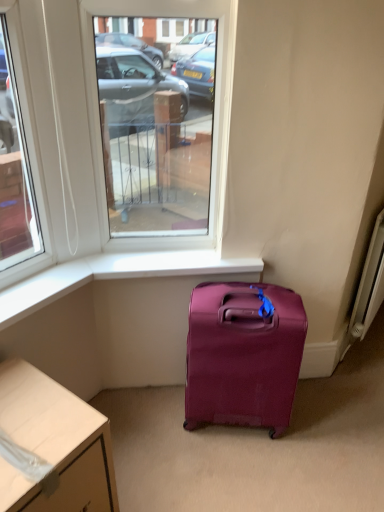
This screenshot has height=512, width=384. What do you see at coordinates (243, 355) in the screenshot?
I see `matte purple suitcase at lower center` at bounding box center [243, 355].

This screenshot has height=512, width=384. What do you see at coordinates (54, 445) in the screenshot?
I see `white glossy desk at lower left` at bounding box center [54, 445].

Describe the element at coordinates (170, 264) in the screenshot. I see `white smooth window sill at lower center` at that location.

Image resolution: width=384 pixels, height=512 pixels. Describe the element at coordinates (95, 123) in the screenshot. I see `clear glass window at center` at that location.

Describe the element at coordinates (369, 284) in the screenshot. I see `white metallic radiator at right` at that location.

This screenshot has width=384, height=512. I want to click on matte purple suitcase at lower center, so click(x=243, y=355).

From the image's perspective, is clear glass window at center beneath matte purple suitcase at lower center?

Incorrect, from the image's perspective, clear glass window at center is higher than matte purple suitcase at lower center.

From a real-world perspective, is clear glass window at center below matte purple suitcase at lower center?

Actually, clear glass window at center is physically above matte purple suitcase at lower center in the real world.

Between point (36, 45) and point (265, 297), which one is positioned in front?

The point (36, 45) is closer to the camera.

Looking at this image, based on their positions, is clear glass window at center located to the left or right of matte purple suitcase at lower center?

From the image, it's evident that clear glass window at center is to the left of matte purple suitcase at lower center.

Consider the image. Is matte purple suitcase at lower center looking in the opposite direction of clear glass window at center?

No, matte purple suitcase at lower center is not facing the opposite direction of clear glass window at center.

Can you confirm if matte purple suitcase at lower center is positioned to the right of clear glass window at center?

Correct, you'll find matte purple suitcase at lower center to the right of clear glass window at center.

Can you confirm if matte purple suitcase at lower center is bigger than clear glass window at center?

Indeed, matte purple suitcase at lower center has a larger size compared to clear glass window at center.

Is matte purple suitcase at lower center positioned far away from clear glass window at center?

Actually, matte purple suitcase at lower center and clear glass window at center are a little close together.

Is white smooth window sill at lower center touching clear glass window at center?

No, white smooth window sill at lower center is not next to clear glass window at center.

Is white smooth window sill at lower center to the right of clear glass window at center from the viewer's perspective?

Yes, white smooth window sill at lower center is to the right of clear glass window at center.

Which of these two, white smooth window sill at lower center or clear glass window at center, is thinner?

Thinner between the two is clear glass window at center.

From a real-world perspective, which is physically below, white smooth window sill at lower center or clear glass window at center?

From a 3D spatial view, white smooth window sill at lower center is below.

From the image's perspective, is white glossy desk at lower left below white smooth window sill at lower center?

Yes, from the image's perspective, white glossy desk at lower left is below white smooth window sill at lower center.

In the image, is white glossy desk at lower left positioned in front of or behind white smooth window sill at lower center?

white glossy desk at lower left is in front of white smooth window sill at lower center.

Are white glossy desk at lower left and white smooth window sill at lower center making contact?

They are not placed beside each other.

Locate an element on the screen. This screenshot has height=512, width=384. desk on the left of white smooth window sill at lower center is located at coordinates tap(54, 445).

Can you tell me how much white smooth window sill at lower center and matte purple suitcase at lower center differ in facing direction?

There is a 11-degree angle between the facing directions of white smooth window sill at lower center and matte purple suitcase at lower center.

Is white smooth window sill at lower center outside of matte purple suitcase at lower center?

Yes, white smooth window sill at lower center is located beyond the bounds of matte purple suitcase at lower center.

In the image, is white smooth window sill at lower center on the left side or the right side of matte purple suitcase at lower center?

white smooth window sill at lower center is positioned on matte purple suitcase at lower center's left side.

From the image's perspective, is white smooth window sill at lower center on matte purple suitcase at lower center?

Yes, from the image's perspective, white smooth window sill at lower center is above matte purple suitcase at lower center.

From a real-world perspective, which is physically above, white metallic radiator at right or white glossy desk at lower left?

white metallic radiator at right, from a real-world perspective.

Which point is more forward, (358, 288) or (88, 438)?

The point (88, 438) is closer.

Is white metallic radiator at right outside of white glossy desk at lower left?

white metallic radiator at right lies outside white glossy desk at lower left's area.

Consider the image. From a real-world perspective, which is physically below, clear glass window at center or white metallic radiator at right?

white metallic radiator at right.

In the scene shown: In terms of height, does clear glass window at center look taller or shorter compared to white metallic radiator at right?

clear glass window at center is taller than white metallic radiator at right.

Which object is further away from the camera, clear glass window at center or white metallic radiator at right?

white metallic radiator at right.

Considering the sizes of objects clear glass window at center and white metallic radiator at right in the image provided, who is smaller, clear glass window at center or white metallic radiator at right?

Smaller between the two is white metallic radiator at right.

Locate an element on the screen. window that appears in front of the matte purple suitcase at lower center is located at coordinates (95, 123).

Where is `luggage and bags lying below the clear glass window at center (from the image's perspective)`? The width and height of the screenshot is (384, 512). luggage and bags lying below the clear glass window at center (from the image's perspective) is located at coordinates (243, 355).

When comparing their distances from clear glass window at center, does white metallic radiator at right or white smooth window sill at lower center seem further?

white metallic radiator at right is positioned further to the anchor clear glass window at center.

Considering their positions, is matte purple suitcase at lower center positioned closer to white smooth window sill at lower center than clear glass window at center?

clear glass window at center is closer to white smooth window sill at lower center.

From the image, which object appears to be farther from white metallic radiator at right, white glossy desk at lower left or matte purple suitcase at lower center?

The object further to white metallic radiator at right is white glossy desk at lower left.

From the image, which object appears to be farther from matte purple suitcase at lower center, white glossy desk at lower left or clear glass window at center?

Among the two, white glossy desk at lower left is located further to matte purple suitcase at lower center.

When comparing their distances from white metallic radiator at right, does white glossy desk at lower left or white smooth window sill at lower center seem further?

white glossy desk at lower left is further to white metallic radiator at right.

Looking at the image, which one is located closer to white glossy desk at lower left, white metallic radiator at right or matte purple suitcase at lower center?

matte purple suitcase at lower center is positioned closer to the anchor white glossy desk at lower left.

When comparing their distances from white smooth window sill at lower center, does white glossy desk at lower left or matte purple suitcase at lower center seem further?

white glossy desk at lower left.

Looking at the image, which one is located closer to matte purple suitcase at lower center, white metallic radiator at right or white glossy desk at lower left?

white glossy desk at lower left is positioned closer to the anchor matte purple suitcase at lower center.

Identify the location of luggage and bags situated between clear glass window at center and white metallic radiator at right from left to right. This screenshot has width=384, height=512. (243, 355).

The image size is (384, 512). In order to click on window sill between clear glass window at center and white glossy desk at lower left in the vertical direction in this screenshot , I will do `click(170, 264)`.

This screenshot has height=512, width=384. Find the location of `luggage and bags situated between white smooth window sill at lower center and white metallic radiator at right from left to right`. luggage and bags situated between white smooth window sill at lower center and white metallic radiator at right from left to right is located at coordinates (243, 355).

The image size is (384, 512). Find the location of `window between white glossy desk at lower left and white metallic radiator at right from left to right`. window between white glossy desk at lower left and white metallic radiator at right from left to right is located at coordinates (95, 123).